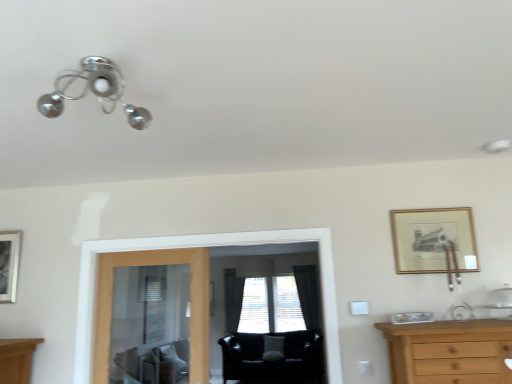
Question: Considering the relative sizes of black fabric curtain at center, arranged as the second curtain when viewed from the left, and transparent glass screen door at center in the image provided, is black fabric curtain at center, arranged as the second curtain when viewed from the left, taller than transparent glass screen door at center?

Choices:
 (A) yes
 (B) no

Answer: (A)

Question: Is black fabric curtain at center, the first curtain positioned from the right, further to the viewer compared to transparent glass screen door at center?

Choices:
 (A) no
 (B) yes

Answer: (B)

Question: Considering the relative sizes of black fabric curtain at center, the first curtain positioned from the right, and transparent glass screen door at center in the image provided, is black fabric curtain at center, the first curtain positioned from the right, bigger than transparent glass screen door at center?

Choices:
 (A) yes
 (B) no

Answer: (B)

Question: Is black fabric curtain at center, arranged as the second curtain when viewed from the left, touching transparent glass screen door at center?

Choices:
 (A) yes
 (B) no

Answer: (B)

Question: Does black fabric curtain at center, arranged as the second curtain when viewed from the left, appear on the left side of transparent glass screen door at center?

Choices:
 (A) yes
 (B) no

Answer: (B)

Question: Looking at their shapes, would you say black fabric curtain at center, the first curtain positioned from the right, is wider or thinner than black fabric curtain at center, which is counted as the 1th curtain, starting from the left?

Choices:
 (A) thin
 (B) wide

Answer: (B)

Question: Is black fabric curtain at center, arranged as the second curtain when viewed from the left, bigger or smaller than black fabric curtain at center, which is counted as the 1th curtain, starting from the left?

Choices:
 (A) big
 (B) small

Answer: (A)

Question: Considering the positions of black fabric curtain at center, arranged as the second curtain when viewed from the left, and black fabric curtain at center, which is counted as the 1th curtain, starting from the left, in the image, is black fabric curtain at center, arranged as the second curtain when viewed from the left, taller or shorter than black fabric curtain at center, which is counted as the 1th curtain, starting from the left,?

Choices:
 (A) tall
 (B) short

Answer: (A)

Question: In the image, is black fabric curtain at center, the first curtain positioned from the right, on the left side or the right side of black fabric curtain at center, which is counted as the second curtain, starting from the right?

Choices:
 (A) left
 (B) right

Answer: (B)

Question: In the image, is silver metallic picture frame at left, which appears as the first picture frame when viewed from the left, positioned in front of or behind clear glass door at center?

Choices:
 (A) front
 (B) behind

Answer: (B)

Question: From a real-world perspective, relative to clear glass door at center, is silver metallic picture frame at left, which is the 2th picture frame in front-to-back order, vertically above or below?

Choices:
 (A) below
 (B) above

Answer: (B)

Question: From the image's perspective, is silver metallic picture frame at left, which is the 2th picture frame in front-to-back order, positioned above or below clear glass door at center?

Choices:
 (A) below
 (B) above

Answer: (B)

Question: Considering the positions of silver metallic picture frame at left, the 1th picture frame in the back-to-front sequence, and clear glass door at center in the image, is silver metallic picture frame at left, the 1th picture frame in the back-to-front sequence, wider or thinner than clear glass door at center?

Choices:
 (A) wide
 (B) thin

Answer: (B)

Question: From the image's perspective, is black fabric curtain at center, the first curtain positioned from the right, above or below gold wooden picture frame at upper right, the second picture frame when ordered from left to right?

Choices:
 (A) above
 (B) below

Answer: (B)

Question: Considering the positions of black fabric curtain at center, arranged as the second curtain when viewed from the left, and gold wooden picture frame at upper right, the second picture frame when ordered from left to right, in the image, is black fabric curtain at center, arranged as the second curtain when viewed from the left, taller or shorter than gold wooden picture frame at upper right, the second picture frame when ordered from left to right,?

Choices:
 (A) short
 (B) tall

Answer: (B)